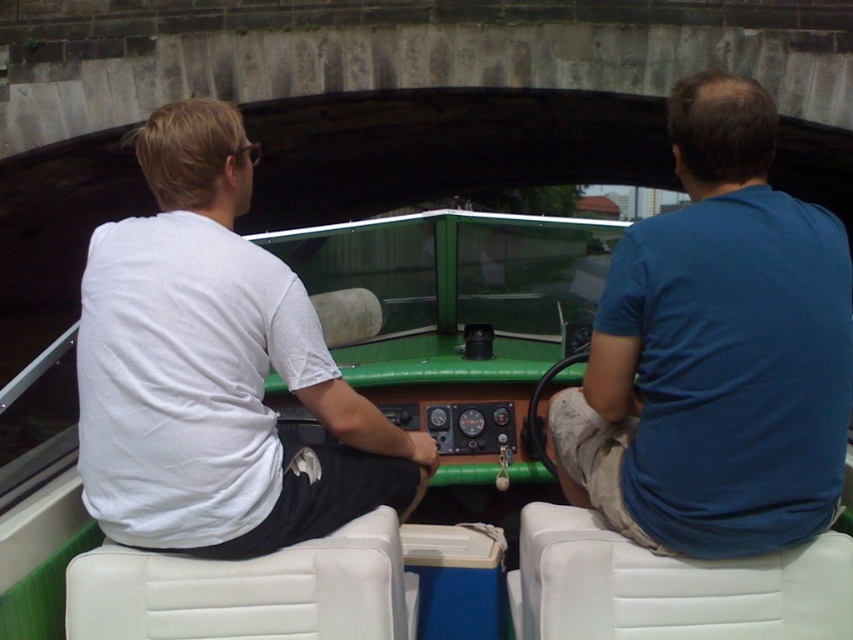
You are a photographer taking a picture of the blue cotton shirt at right and the white cotton shirt at left from the front of the boat. Which shirt will appear closer to the bottom of the photo?

The blue cotton shirt at right will appear closer to the bottom of the photo because it is positioned under the white cotton shirt at left.

You are a passenger on a canal boat and want to sit next to the person wearing a blue cotton shirt at right. Which direction should you move from your current position at the white cotton shirt at left?

The blue cotton shirt at right is positioned on the right side of white cotton shirt at left, so you should move to the right to sit next to them.

You are on a canal boat and need to locate two specific points marked on the boat. The first point is at coordinates point (x=688, y=284) and the second is at point (x=152, y=186). Which of these two points is nearer to you?

Point (x=688, y=284) is closer to the viewer than point (x=152, y=186).